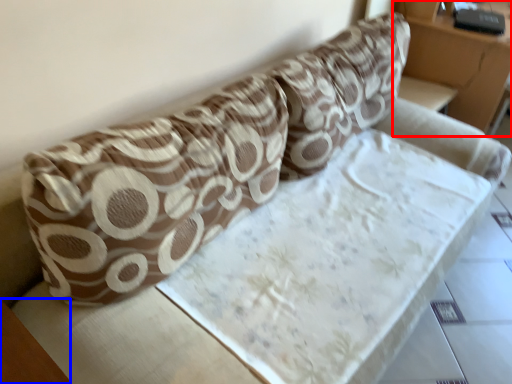
Question: Which object appears farthest to the camera in this image, furniture (highlighted by a red box) or table (highlighted by a blue box)?

Choices:
 (A) furniture
 (B) table

Answer: (A)